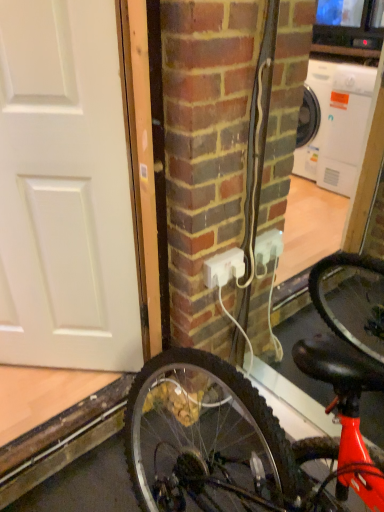
Question: Is white matte door at left positioned with its back to white plastic power outlet at center?

Choices:
 (A) yes
 (B) no

Answer: (B)

Question: Could you tell me if white matte door at left is facing white plastic power outlet at center?

Choices:
 (A) no
 (B) yes

Answer: (A)

Question: Is white matte door at left outside white plastic power outlet at center?

Choices:
 (A) no
 (B) yes

Answer: (B)

Question: Does white matte door at left have a lesser width compared to white plastic power outlet at center?

Choices:
 (A) yes
 (B) no

Answer: (B)

Question: Would you say white matte door at left contains white plastic power outlet at center?

Choices:
 (A) yes
 (B) no

Answer: (B)

Question: From the image's perspective, is white matte door at left on top of white plastic power outlet at center?

Choices:
 (A) no
 (B) yes

Answer: (B)

Question: Is white matte door at left surrounded by white plastic power outlet at center?

Choices:
 (A) yes
 (B) no

Answer: (B)

Question: Is white matte door at left at the back of white plastic power outlet at center?

Choices:
 (A) no
 (B) yes

Answer: (A)

Question: Considering the relative sizes of white plastic power outlet at center and white matte door at left in the image provided, is white plastic power outlet at center taller than white matte door at left?

Choices:
 (A) yes
 (B) no

Answer: (B)

Question: From the image's perspective, does white plastic power outlet at center appear higher than white matte door at left?

Choices:
 (A) no
 (B) yes

Answer: (A)

Question: Does white plastic power outlet at center come behind white matte door at left?

Choices:
 (A) no
 (B) yes

Answer: (B)

Question: From a real-world perspective, is white plastic power outlet at center beneath white matte door at left?

Choices:
 (A) no
 (B) yes

Answer: (B)

Question: In terms of width, does white plastic power outlet at center look wider or thinner when compared to white matte door at left?

Choices:
 (A) wide
 (B) thin

Answer: (B)